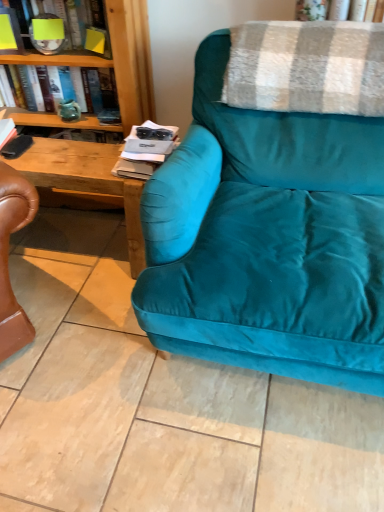
Question: From the image's perspective, is plaid woolen blanket at upper right under matte black magazine at center?

Choices:
 (A) no
 (B) yes

Answer: (A)

Question: Is plaid woolen blanket at upper right positioned far away from matte black magazine at center?

Choices:
 (A) yes
 (B) no

Answer: (B)

Question: Is plaid woolen blanket at upper right thinner than matte black magazine at center?

Choices:
 (A) no
 (B) yes

Answer: (B)

Question: Considering the relative sizes of plaid woolen blanket at upper right and matte black magazine at center in the image provided, is plaid woolen blanket at upper right taller than matte black magazine at center?

Choices:
 (A) yes
 (B) no

Answer: (A)

Question: Does plaid woolen blanket at upper right have a smaller size compared to matte black magazine at center?

Choices:
 (A) yes
 (B) no

Answer: (B)

Question: Is plaid woolen blanket at upper right bigger than matte black magazine at center?

Choices:
 (A) yes
 (B) no

Answer: (A)

Question: Are yellow paper at upper left, arranged as the 1th book when viewed from the top, and teal velvet couch at center located far from each other?

Choices:
 (A) yes
 (B) no

Answer: (B)

Question: Considering the relative sizes of yellow paper at upper left, arranged as the 1th book when viewed from the top, and teal velvet couch at center in the image provided, is yellow paper at upper left, arranged as the 1th book when viewed from the top, bigger than teal velvet couch at center?

Choices:
 (A) yes
 (B) no

Answer: (B)

Question: Can we say yellow paper at upper left, the 2th book when ordered from bottom to top, lies outside teal velvet couch at center?

Choices:
 (A) yes
 (B) no

Answer: (A)

Question: Considering the relative sizes of yellow paper at upper left, arranged as the 1th book when viewed from the top, and teal velvet couch at center in the image provided, is yellow paper at upper left, arranged as the 1th book when viewed from the top, taller than teal velvet couch at center?

Choices:
 (A) no
 (B) yes

Answer: (A)

Question: From the image's perspective, is yellow paper at upper left, arranged as the 1th book when viewed from the top, below teal velvet couch at center?

Choices:
 (A) yes
 (B) no

Answer: (B)

Question: From a real-world perspective, is yellow paper at upper left, the 2th book when ordered from bottom to top, located higher than teal velvet couch at center?

Choices:
 (A) no
 (B) yes

Answer: (B)

Question: Is green glass vase at upper left, which appears as the second book when viewed from the top, taller than plaid woolen blanket at upper right?

Choices:
 (A) no
 (B) yes

Answer: (A)